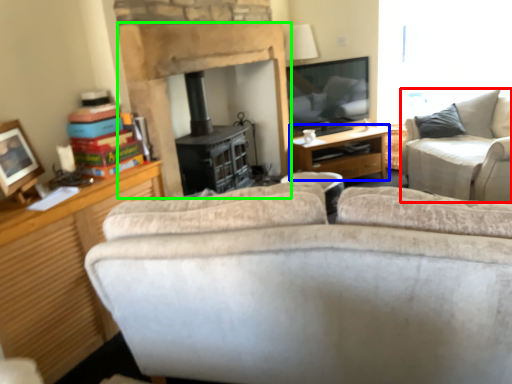
Question: Which object is the closest to the studio couch (highlighted by a red box)? Choose among these: desk (highlighted by a blue box) or fireplace (highlighted by a green box).

Choices:
 (A) desk
 (B) fireplace

Answer: (A)